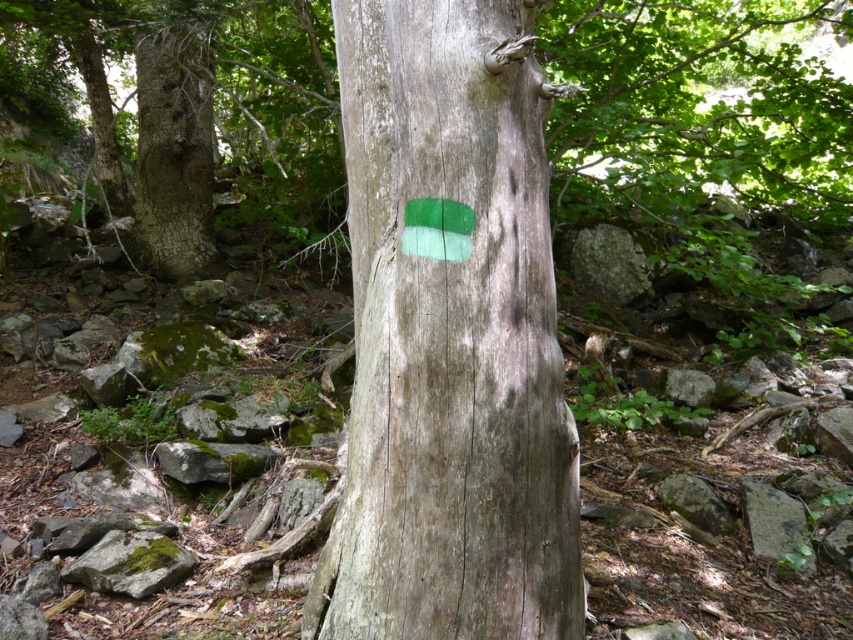
You are a hiker who needs to place a 3.5 feet long hiking pole between the green matte paint at center and the green mossy rock at lower left. Can the pole fit between them without bending?

The distance between the green matte paint at center and the green mossy rock at lower left is 4.41 feet, which is longer than the 3.5 feet length of the hiking pole. Therefore, the pole can fit between them without bending.

You are a hiker trying to follow the trail markers. You see the green matte paint at center and the green mossy rock at lower left. Which one is closer to you?

The green matte paint at center is closer to you because it is in front of the green mossy rock at lower left.